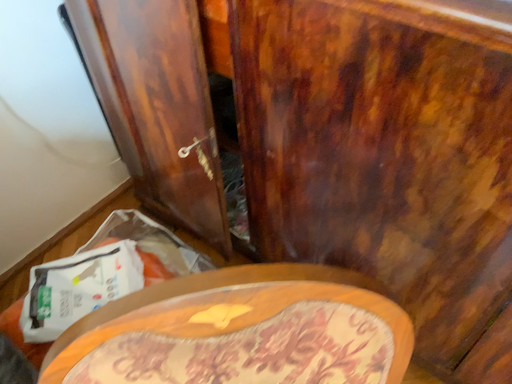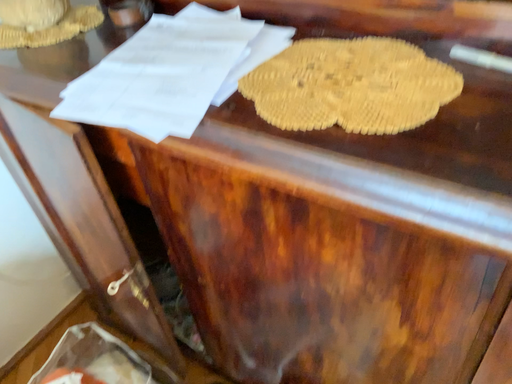
Question: How did the camera likely rotate when shooting the video?

Choices:
 (A) rotated upward
 (B) rotated downward

Answer: (A)